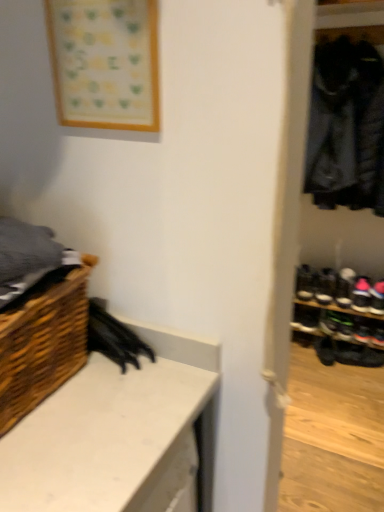
You are a GUI agent. You are given a task and a screenshot of the screen. Output one action in this format:
    pyautogui.click(x=<x>, y=<y>)
    Task: Click on the vacant area on top of black leather shoe at lower right, which appears as the first footwear when ordered from the bottom (from a real-world perspective)
    This screenshot has height=512, width=384.
    Given the screenshot: What is the action you would take?
    pyautogui.click(x=363, y=342)